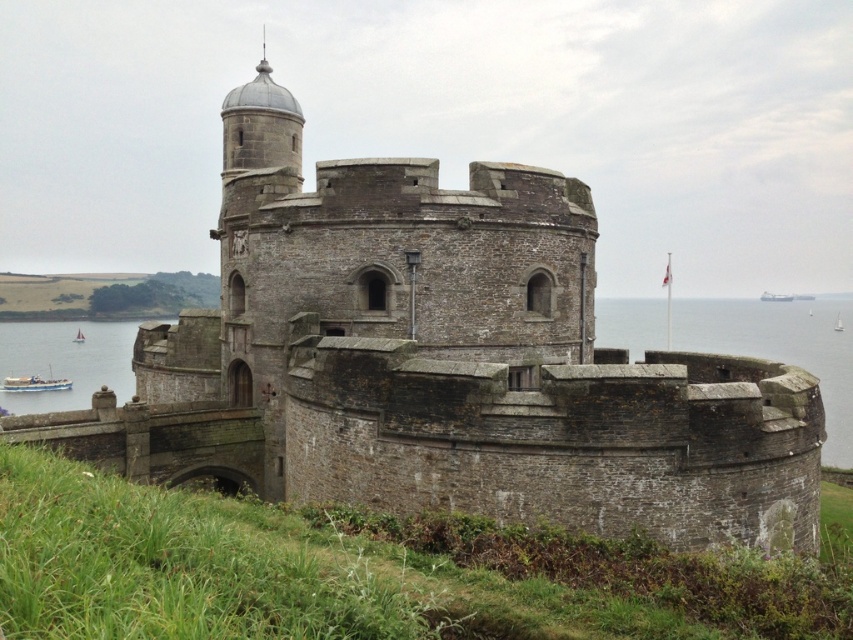
You are a tourist visiting the fortress and want to take a photo of the gray stone water at right and the blue water at lower left. Which one of these two waters is bigger in size?

The gray stone water at right has a larger size compared to the blue water at lower left, so the gray stone water at right is bigger in size.

Consider the image. You are standing on the fortress and want to cross to the other side of the blue water at lower left using the white sailboat at lower left. Can you safely navigate the sailboat across the water?

The blue water at lower left might be wider than the white sailboat at lower left, so it is possible that the sailboat can navigate across the water since the water width is at least as wide as the boat.